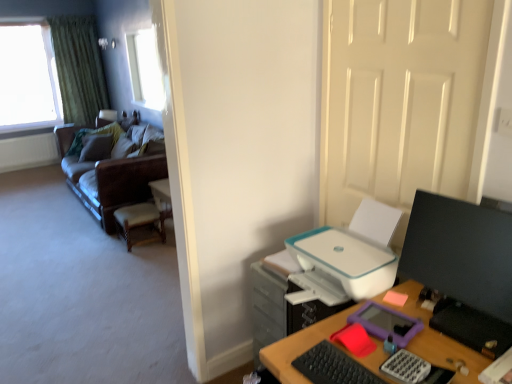
Question: Is pink matte sticky notes at right aimed at transparent glass window at upper left, which is the second window from right to left?

Choices:
 (A) no
 (B) yes

Answer: (A)

Question: From the image's perspective, does pink matte sticky notes at right appear lower than transparent glass window at upper left, which appears as the 1th window when viewed from the left?

Choices:
 (A) no
 (B) yes

Answer: (B)

Question: From a real-world perspective, is pink matte sticky notes at right physically below transparent glass window at upper left, positioned as the 1th window in back-to-front order?

Choices:
 (A) yes
 (B) no

Answer: (A)

Question: Does pink matte sticky notes at right have a greater width compared to transparent glass window at upper left, which appears as the 1th window when viewed from the left?

Choices:
 (A) yes
 (B) no

Answer: (B)

Question: Is pink matte sticky notes at right bigger than transparent glass window at upper left, which is the second window from right to left?

Choices:
 (A) no
 (B) yes

Answer: (A)

Question: Are pink matte sticky notes at right and transparent glass window at upper left, positioned as the 1th window in back-to-front order, located far from each other?

Choices:
 (A) no
 (B) yes

Answer: (B)

Question: Is velvet green pillow at left oriented towards wooden woven seat at left?

Choices:
 (A) no
 (B) yes

Answer: (A)

Question: From a real-world perspective, is velvet green pillow at left below wooden woven seat at left?

Choices:
 (A) yes
 (B) no

Answer: (B)

Question: Is wooden woven seat at left completely or partially inside velvet green pillow at left?

Choices:
 (A) yes
 (B) no

Answer: (B)

Question: Is wooden woven seat at left at the back of velvet green pillow at left?

Choices:
 (A) yes
 (B) no

Answer: (B)

Question: Does velvet green pillow at left have a greater width compared to wooden woven seat at left?

Choices:
 (A) no
 (B) yes

Answer: (A)

Question: From the image's perspective, is velvet green pillow at left over wooden woven seat at left?

Choices:
 (A) yes
 (B) no

Answer: (A)

Question: Does black matte keyboard at lower right have a larger size compared to pink matte sticky notes at right?

Choices:
 (A) yes
 (B) no

Answer: (A)